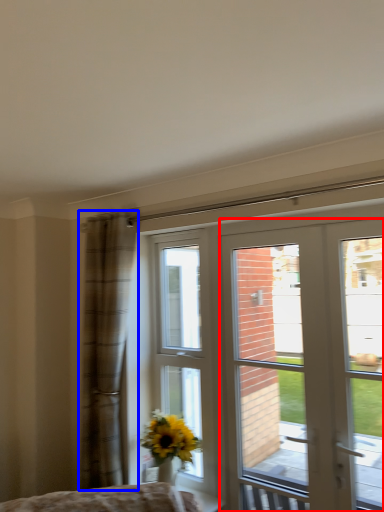
Question: Which point is closer to the camera, door (highlighted by a red box) or curtain (highlighted by a blue box)?

Choices:
 (A) door
 (B) curtain

Answer: (A)